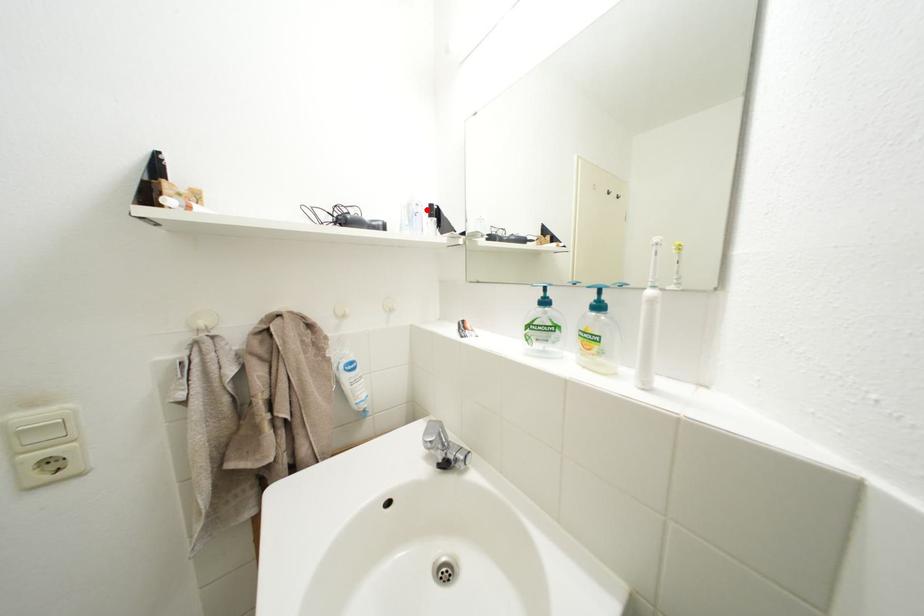
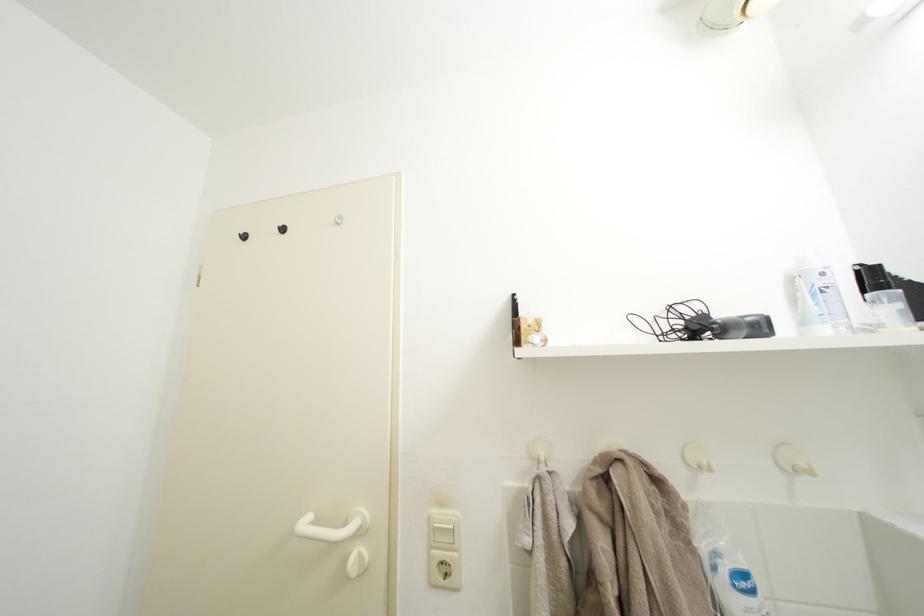
Find the pixel in the second image that matches the highlighted location in the first image.

(833, 280)